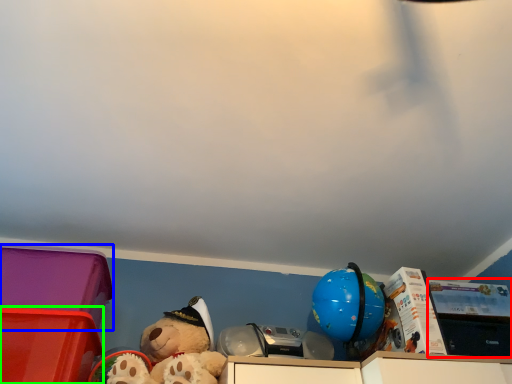
Question: Estimate the real-world distances between objects in this image. Which object is closer to storage box (highlighted by a red box), storage box (highlighted by a blue box) or storage box (highlighted by a green box)?

Choices:
 (A) storage box
 (B) storage box

Answer: (A)